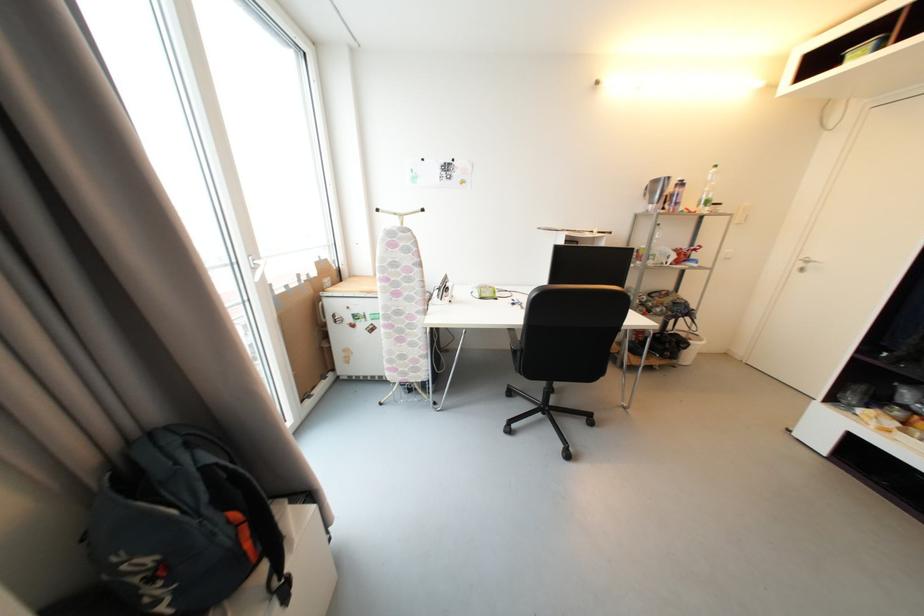
Where is `white window handle`? The height and width of the screenshot is (616, 924). white window handle is located at coordinates (256, 267).